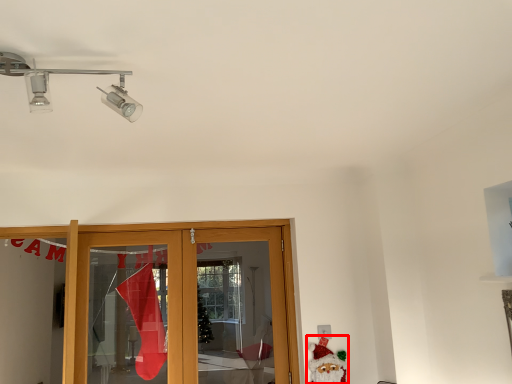
Question: From the image's perspective, what is the correct spatial positioning of santa claus (annotated by the red box) in reference to light fixture?

Choices:
 (A) below
 (B) above

Answer: (A)